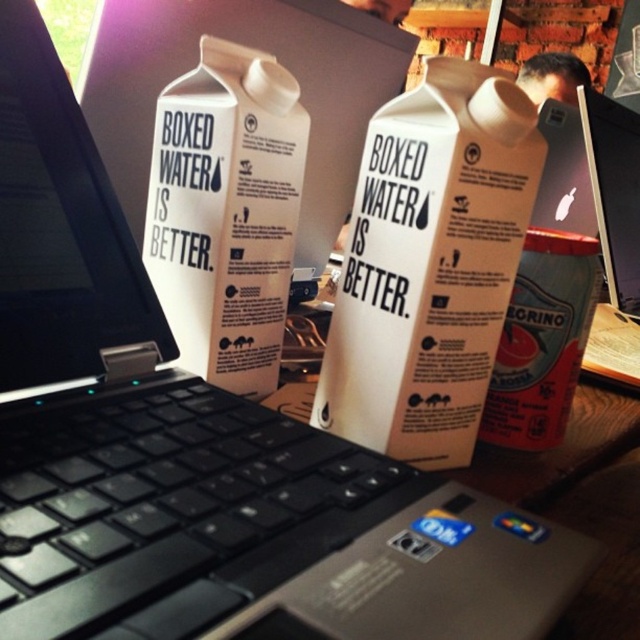
Is black plastic keyboard at center closer to camera compared to white matte carton at center?

Yes.

Is point (44, 467) farther from camera compared to point (246, 340)?

No.

Between point (268, 486) and point (276, 232), which one is positioned in front?

Point (268, 486) is in front.

Identify the location of black plastic keyboard at center. (170, 506).

Between black plastic keyboard at center and metallic silver can at right, which one appears on the right side from the viewer's perspective?

A: metallic silver can at right

Where is `black plastic keyboard at center`? Image resolution: width=640 pixels, height=640 pixels. black plastic keyboard at center is located at coordinates (170, 506).

Between point (237, 422) and point (500, 368), which one is positioned behind?

Positioned behind is point (500, 368).

This screenshot has height=640, width=640. What are the coordinates of `black plastic keyboard at center` in the screenshot? It's located at (170, 506).

Can you confirm if white matte carton at center is taller than metallic silver can at right?

Correct, white matte carton at center is much taller as metallic silver can at right.

Is point (168, 237) behind point (572, 257)?

That is True.

Identify the location of white matte carton at center. This screenshot has height=640, width=640. tap(227, 212).